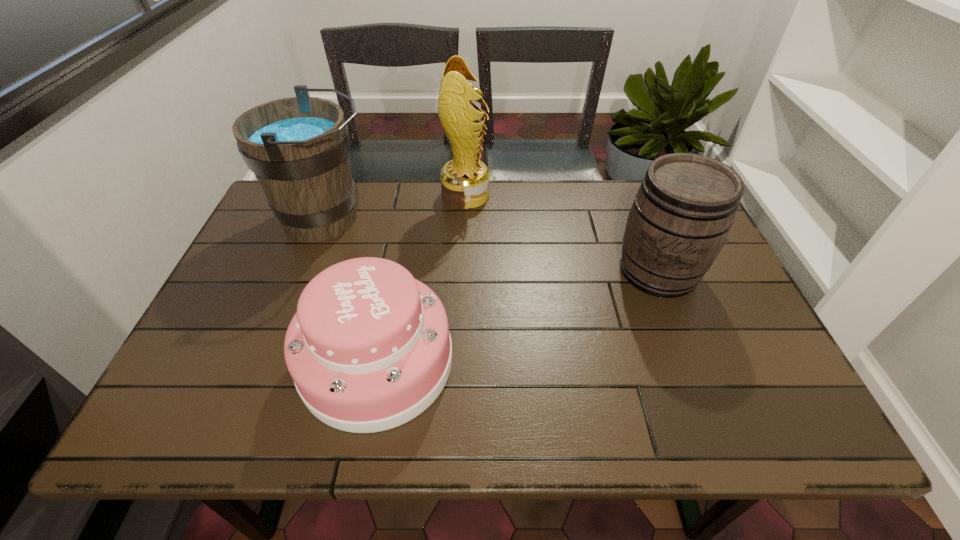
Locate an element on the screen. This screenshot has width=960, height=540. the tallest object is located at coordinates (465, 181).

Identify the location of the left wine bucket. This screenshot has width=960, height=540. (298, 147).

The height and width of the screenshot is (540, 960). Identify the location of the shorter wine bucket. (680, 218).

Locate an element on the screen. the right wine bucket is located at coordinates (680, 218).

Find the location of a particular element. The width and height of the screenshot is (960, 540). the shortest object is located at coordinates (369, 349).

Locate an element on the screen. the nearest object is located at coordinates (369, 349).

This screenshot has height=540, width=960. I want to click on vacant space located on the front-facing side of the tallest object, so click(x=556, y=195).

Locate an element on the screen. This screenshot has width=960, height=540. vacant space located 0.360m with a handle on the side of the left wine bucket is located at coordinates (499, 219).

The height and width of the screenshot is (540, 960). Find the location of `free space located 0.080m on the front of the rightmost object`. free space located 0.080m on the front of the rightmost object is located at coordinates (681, 329).

The height and width of the screenshot is (540, 960). In order to click on vacant space located on the back of the cake in this screenshot , I will do `click(403, 226)`.